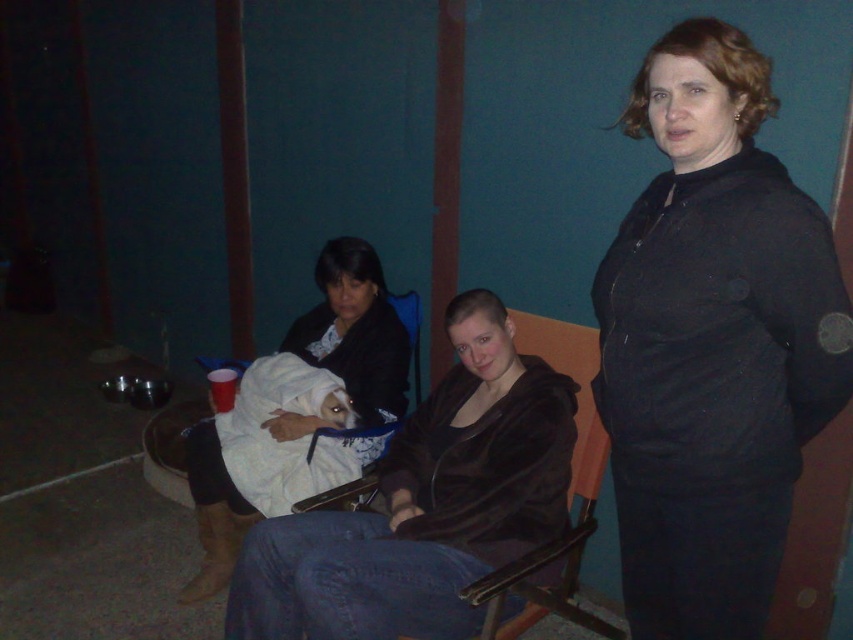
You are standing in the room and notice two points marked in the image. Which point, point (619, 497) or point (260, 419), is closer to you?

Point (619, 497) is closer to the viewer than point (260, 419).

You are organizing a charity event and need to arrange items on a table. You have a velvet brown jacket at center and a white towel at center. According to the scene description, where should you place the velvet brown jacket relative to the white towel?

The velvet brown jacket at center should be placed on the right side of the white towel at center as per the scene description.

You are a photographer setting up a shoot in this room. You have a black matte jacket at center and a white towel at center. Which object should you adjust first to ensure proper lighting on both items?

The black matte jacket at center is in front of the white towel at center. To ensure proper lighting on both items, you should adjust the black matte jacket at center first so it doesn not block the light reaching the white towel at center behind it.